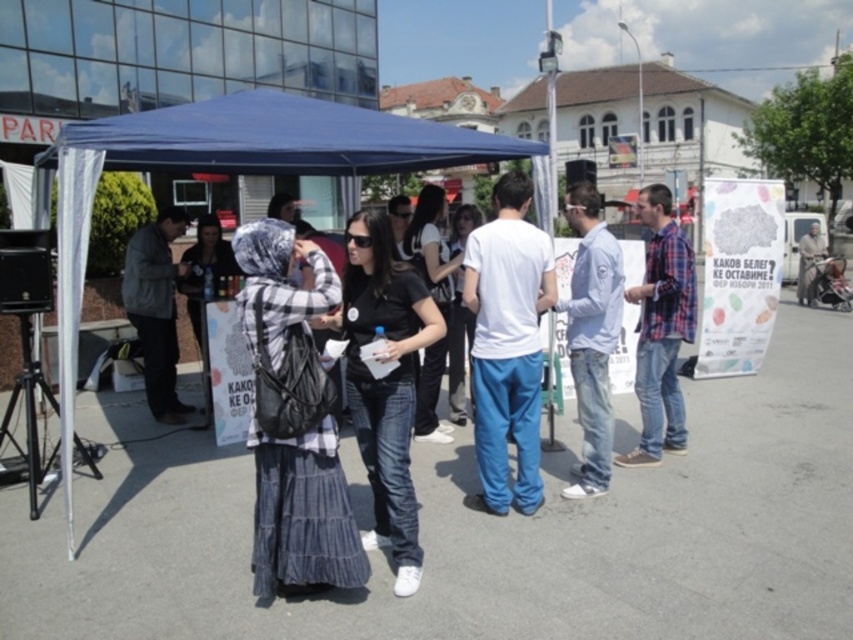
Between blue fabric tent at center and plaid shirt at right, which one is positioned higher?

blue fabric tent at center

Which is more to the left, blue fabric tent at center or plaid shirt at right?

Positioned to the left is blue fabric tent at center.

Does point (90, 147) come farther from viewer compared to point (685, 301)?

No, it is in front of (685, 301).

Identify the location of blue fabric tent at center. Image resolution: width=853 pixels, height=640 pixels. (230, 172).

Is blue fabric tent at center wider than white cotton t-shirt at center?

No.

Locate an element on the screen. The height and width of the screenshot is (640, 853). blue fabric tent at center is located at coordinates (230, 172).

Can you confirm if white cotton t-shirt at center is taller than dark gray jacket at left?

Indeed, white cotton t-shirt at center has a greater height compared to dark gray jacket at left.

How distant is white cotton t-shirt at center from dark gray jacket at left?

A distance of 10.53 feet exists between white cotton t-shirt at center and dark gray jacket at left.

Between point (509, 364) and point (126, 272), which one is positioned in front?

Point (509, 364) is in front.

At what (x,y) coordinates should I click in order to perform the action: click on white cotton t-shirt at center. Please return your answer as a coordinate pair (x, y). This screenshot has height=640, width=853. Looking at the image, I should click on (508, 344).